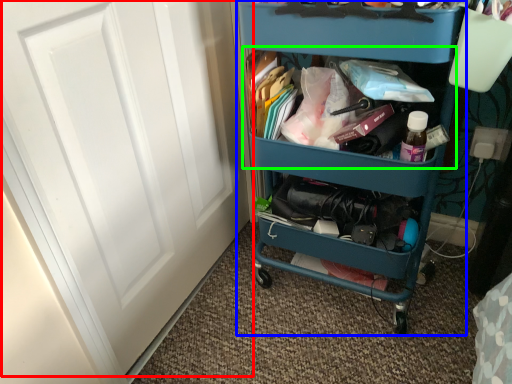
Question: Considering the real-world distances, which object is closest to door (highlighted by a red box)? furniture (highlighted by a blue box) or cabinet (highlighted by a green box).

Choices:
 (A) furniture
 (B) cabinet

Answer: (A)